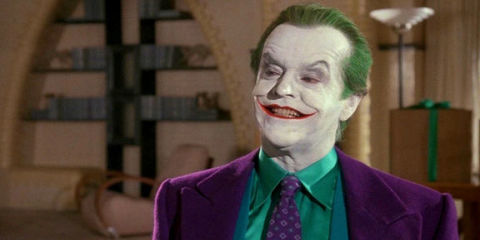
Locate an element on the screen. curtain is located at coordinates (461, 66).